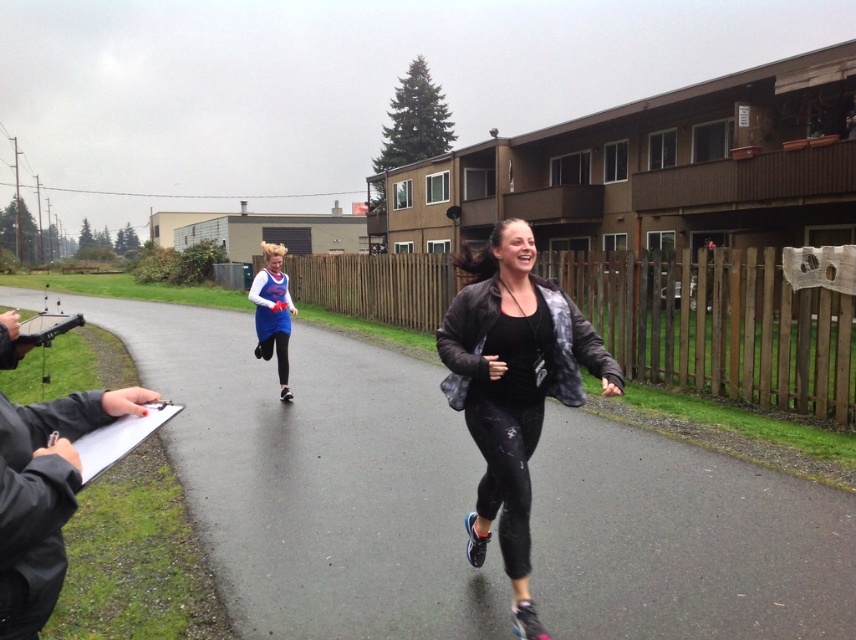
You are a spectator watching a race between the black matte jacket at center and the blue jersey at center. Who is currently leading the race?

The black matte jacket at center is leading the race because it is positioned in front of the blue jersey at center.

You are a photographer at the event and need to capture a closeup of the black matte jacket at center. The focus point of your camera is currently at point (513, 387). Is this focus point positioned correctly to capture the black matte jacket at center?

Yes, the focus point at point (513, 387) is correctly positioned on the black matte jacket at center, so it will capture the black matte jacket at center clearly.